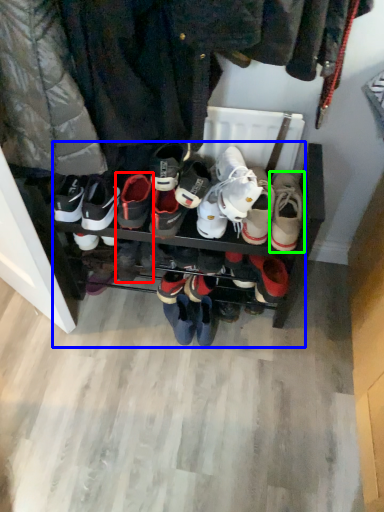
Question: Which is nearer to the footwear (highlighted by a red box)? footwear (highlighted by a blue box) or footwear (highlighted by a green box).

Choices:
 (A) footwear
 (B) footwear

Answer: (A)